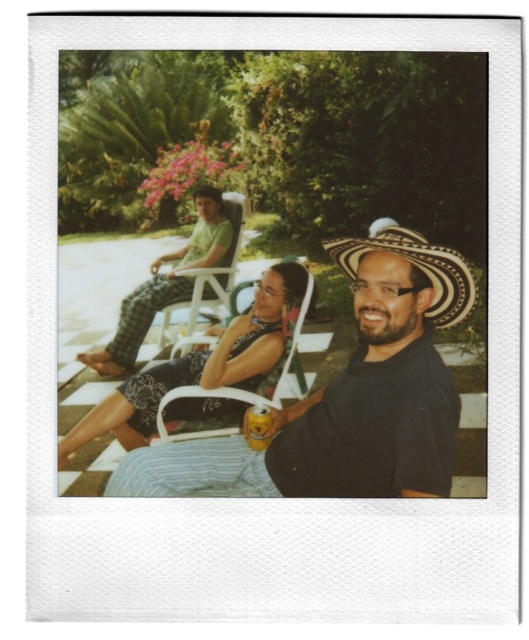
Between white plastic beach chair at upper center and yellow matte can at center, which one is positioned lower?

yellow matte can at center

How much distance is there between white plastic beach chair at upper center and yellow matte can at center?

A distance of 7.53 feet exists between white plastic beach chair at upper center and yellow matte can at center.

Locate an element on the screen. The image size is (529, 640). white plastic beach chair at upper center is located at coordinates click(x=207, y=275).

Which is in front, point (233, 486) or point (313, 280)?

Positioned in front is point (233, 486).

Which is in front, point (382, 368) or point (242, 394)?

Point (382, 368)

Where is `black matte shirt at center`? The image size is (529, 640). black matte shirt at center is located at coordinates (346, 396).

In the scene shown: Is black matte shirt at center thinner than yellow matte can at center?

Incorrect, black matte shirt at center's width is not less than yellow matte can at center's.

Measure the distance between black matte shirt at center and camera.

black matte shirt at center and camera are 1.22 meters apart.

The height and width of the screenshot is (640, 529). I want to click on black matte shirt at center, so click(346, 396).